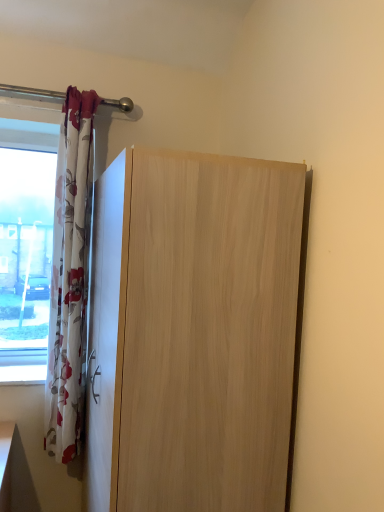
Question: Is point (71, 129) positioned closer to the camera than point (162, 287)?

Choices:
 (A) farther
 (B) closer

Answer: (A)

Question: From the image's perspective, is floral fabric curtain at left positioned above or below light wood cupboard at center?

Choices:
 (A) below
 (B) above

Answer: (B)

Question: In terms of width, does floral fabric curtain at left look wider or thinner when compared to light wood cupboard at center?

Choices:
 (A) wide
 (B) thin

Answer: (B)

Question: Is light wood cupboard at center taller or shorter than floral fabric curtain at left?

Choices:
 (A) short
 (B) tall

Answer: (A)

Question: Based on their positions, is light wood cupboard at center located to the left or right of floral fabric curtain at left?

Choices:
 (A) left
 (B) right

Answer: (B)

Question: Is point (195, 392) positioned closer to the camera than point (61, 196)?

Choices:
 (A) farther
 (B) closer

Answer: (B)

Question: From the image's perspective, is light wood cupboard at center positioned above or below floral fabric curtain at left?

Choices:
 (A) below
 (B) above

Answer: (A)